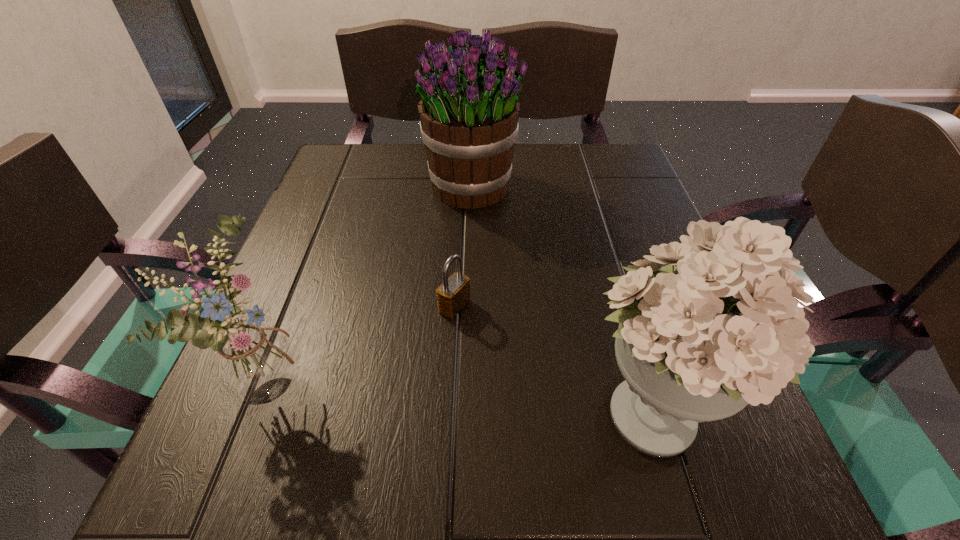
In the image, there is a desktop. Where is `vacant space at the near left corner`? Image resolution: width=960 pixels, height=540 pixels. vacant space at the near left corner is located at coordinates (170, 509).

This screenshot has width=960, height=540. I want to click on free location at the far right corner, so click(595, 160).

The image size is (960, 540). Find the location of `free space at the near right corner of the desktop`. free space at the near right corner of the desktop is located at coordinates (746, 469).

I want to click on free space between the second shortest object and the second bouquet from left to right, so click(x=373, y=284).

Locate an element on the screen. The height and width of the screenshot is (540, 960). vacant area that lies between the rightmost object and the second bouquet from left to right is located at coordinates (562, 298).

Image resolution: width=960 pixels, height=540 pixels. I want to click on vacant area that lies between the padlock and the second bouquet from left to right, so click(x=464, y=247).

Where is `free space that is in between the shortest bouquet and the shortest object`? This screenshot has height=540, width=960. free space that is in between the shortest bouquet and the shortest object is located at coordinates (365, 343).

Find the location of a particular element. The width and height of the screenshot is (960, 540). free area in between the shortest object and the farthest object is located at coordinates (464, 247).

Where is `vacant region between the rightmost bouquet and the padlock`? Image resolution: width=960 pixels, height=540 pixels. vacant region between the rightmost bouquet and the padlock is located at coordinates [553, 357].

This screenshot has width=960, height=540. In order to click on empty space that is in between the rightmost object and the farthest bouquet in this screenshot , I will do `click(562, 298)`.